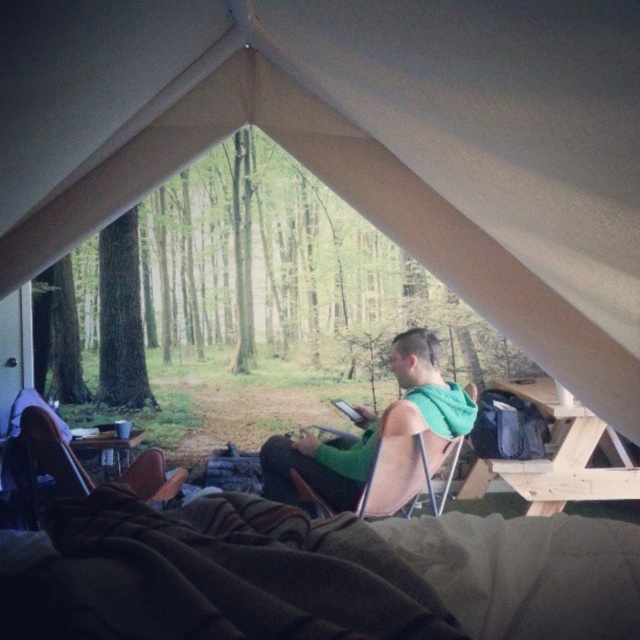
Question: Can you confirm if green hoodie at center is smaller than wooden picnic table at lower right?

Choices:
 (A) no
 (B) yes

Answer: (B)

Question: Is green hoodie at center wider than wooden picnic table at center?

Choices:
 (A) no
 (B) yes

Answer: (B)

Question: Does brown leather chair at lower left appear on the left side of wooden picnic table at center?

Choices:
 (A) yes
 (B) no

Answer: (A)

Question: Which point is closer to the camera?

Choices:
 (A) wooden picnic table at center
 (B) green hoodie at center

Answer: (B)

Question: Based on their relative distances, which object is nearer to the brown leather chair at lower left?

Choices:
 (A) green hoodie at center
 (B) wooden picnic table at center
 (C) wooden picnic table at lower right

Answer: (B)

Question: Which of the following is the farthest from the observer?

Choices:
 (A) brown leather chair at lower left
 (B) green hoodie at center
 (C) wooden picnic table at center
 (D) wooden picnic table at lower right

Answer: (C)